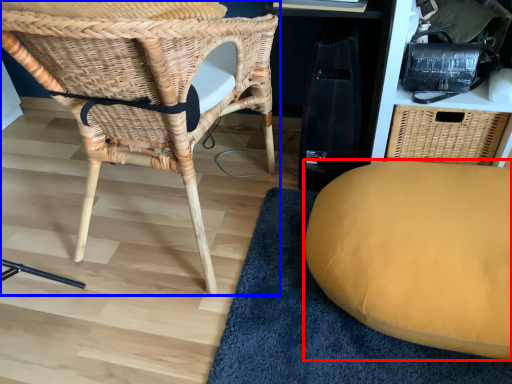
Question: Among these objects, which one is farthest to the camera, furniture (highlighted by a red box) or chair (highlighted by a blue box)?

Choices:
 (A) furniture
 (B) chair

Answer: (A)